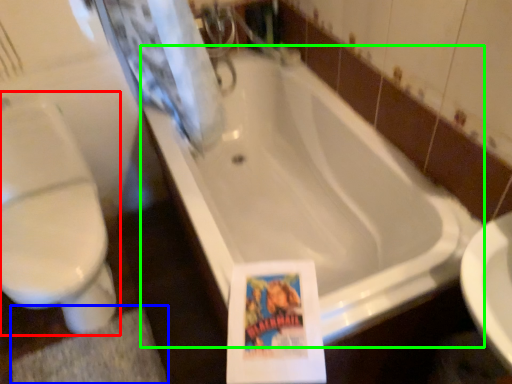
Question: Which is nearer to the toilet (highlighted by a red box)? bath mat (highlighted by a blue box) or bathtub (highlighted by a green box).

Choices:
 (A) bath mat
 (B) bathtub

Answer: (A)